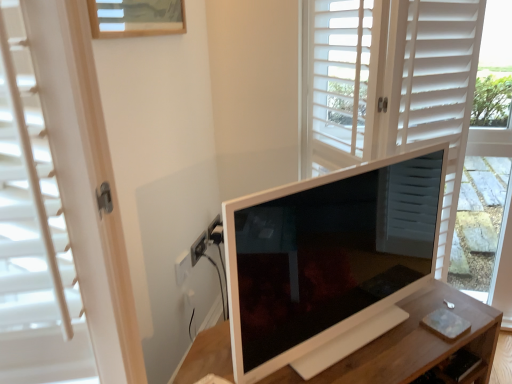
Describe the element at coordinates (412, 344) in the screenshot. I see `white wooden table at center` at that location.

From the picture: What is the approximate width of wooden drawer at lower right?

The width of wooden drawer at lower right is 16.11 centimeters.

Locate an element on the screen. The image size is (512, 384). white wooden table at center is located at coordinates (412, 344).

From a real-world perspective, is wooden drawer at lower right physically located above or below white glossy monitor at center?

wooden drawer at lower right is situated lower than white glossy monitor at center in the real world.

Which of these two, wooden drawer at lower right or white glossy monitor at center, stands taller?

With more height is white glossy monitor at center.

Where is `television above the wooden drawer at lower right (from the image's perspective)`? Image resolution: width=512 pixels, height=384 pixels. television above the wooden drawer at lower right (from the image's perspective) is located at coordinates (328, 255).

Which point is more distant from viewer, (421, 378) or (390, 199)?

Point (421, 378)

From the image's perspective, between wooden drawer at lower right and white wooden table at center, which one is located above?

wooden drawer at lower right.

Between wooden drawer at lower right and white wooden table at center, which one has larger width?

white wooden table at center is wider.

Can you confirm if wooden drawer at lower right is positioned to the left of white wooden table at center?

No.

How far apart are wooden drawer at lower right and white wooden table at center?

They are 5.68 inches apart.

Which is closer, (401,41) or (201,375)?

Point (401,41) is farther from the camera than point (201,375).

Which object is wider, matte white screen door at center or white wooden table at center?

Wider between the two is matte white screen door at center.

Is matte white screen door at center at the right side of white wooden table at center?

Yes, matte white screen door at center is to the right of white wooden table at center.

From a real-world perspective, is white wooden table at center positioned over matte white screen door at center based on gravity?

No, from a real-world perspective, white wooden table at center is not over matte white screen door at center

Which object is wider, white wooden table at center or matte white screen door at center?

matte white screen door at center.

Between white wooden table at center and matte white screen door at center, which one is positioned in front?

white wooden table at center is closer to the camera.

From the image's perspective, is white wooden table at center located above or below matte white screen door at center?

white wooden table at center is situated lower than matte white screen door at center in the image.

From the image's perspective, who appears lower, matte white screen door at center or wooden drawer at lower right?

wooden drawer at lower right.

Considering the sizes of objects matte white screen door at center and wooden drawer at lower right in the image provided, who is wider, matte white screen door at center or wooden drawer at lower right?

With larger width is matte white screen door at center.

Is matte white screen door at center oriented towards wooden drawer at lower right?

No, matte white screen door at center is not aimed at wooden drawer at lower right.

Is matte white screen door at center further to the viewer compared to wooden drawer at lower right?

No, matte white screen door at center is in front of wooden drawer at lower right.

In the image, is white glossy monitor at center on the left side or the right side of white wooden table at center?

white glossy monitor at center is to the right of white wooden table at center.

Is white glossy monitor at center turned away from white wooden table at center?

white glossy monitor at center is not turned away from white wooden table at center.

From the image's perspective, is white glossy monitor at center beneath white wooden table at center?

Actually, white glossy monitor at center appears above white wooden table at center in the image.

How many degrees apart are the facing directions of white glossy monitor at center and white wooden table at center?

The angular difference between white glossy monitor at center and white wooden table at center is 1.94 degrees.

From the image's perspective, between white glossy monitor at center and matte white screen door at center, which one is located above?

matte white screen door at center.

Considering the sizes of objects white glossy monitor at center and matte white screen door at center in the image provided, who is shorter, white glossy monitor at center or matte white screen door at center?

white glossy monitor at center is shorter.

Which object is further away from the camera taking this photo, white glossy monitor at center or matte white screen door at center?

matte white screen door at center is further away from the camera.

Is white glossy monitor at center beside matte white screen door at center?

They are not placed beside each other.

Find the location of a particular element. Image resolution: width=512 pixels, height=384 pixels. drawer that is on the right side of white glossy monitor at center is located at coordinates (459, 366).

The image size is (512, 384). Find the location of `drawer located above the white wooden table at center (from the image's perspective)`. drawer located above the white wooden table at center (from the image's perspective) is located at coordinates (459, 366).

Which object lies further to the anchor point white wooden table at center, wooden drawer at lower right or white glossy monitor at center?

white glossy monitor at center is further to white wooden table at center.

Which object lies further to the anchor point wooden drawer at lower right, matte white screen door at center or white wooden table at center?

Among the two, matte white screen door at center is located further to wooden drawer at lower right.

Based on their spatial positions, is matte white screen door at center or wooden drawer at lower right closer to white glossy monitor at center?

matte white screen door at center lies closer to white glossy monitor at center than the other object.

Estimate the real-world distances between objects in this image. Which object is closer to wooden drawer at lower right, white wooden table at center or white glossy monitor at center?

white wooden table at center is positioned closer to the anchor wooden drawer at lower right.

Based on the photo, based on their spatial positions, is matte white screen door at center or white glossy monitor at center closer to white wooden table at center?

white glossy monitor at center is positioned closer to the anchor white wooden table at center.

Estimate the real-world distances between objects in this image. Which object is closer to white glossy monitor at center, wooden drawer at lower right or matte white screen door at center?

Based on the image, matte white screen door at center appears to be nearer to white glossy monitor at center.

When comparing their distances from matte white screen door at center, does white wooden table at center or wooden drawer at lower right seem further?

wooden drawer at lower right lies further to matte white screen door at center than the other object.

Based on their spatial positions, is white wooden table at center or matte white screen door at center further from wooden drawer at lower right?

matte white screen door at center is positioned further to the anchor wooden drawer at lower right.

Identify the location of table located between white glossy monitor at center and wooden drawer at lower right in the depth direction. This screenshot has height=384, width=512. (412, 344).

Locate an element on the screen. television between matte white screen door at center and white wooden table at center in the up-down direction is located at coordinates (328, 255).

Locate an element on the screen. drawer between matte white screen door at center and white wooden table at center in the vertical direction is located at coordinates (459, 366).

Locate an element on the screen. The height and width of the screenshot is (384, 512). television between matte white screen door at center and wooden drawer at lower right in the up-down direction is located at coordinates (328, 255).